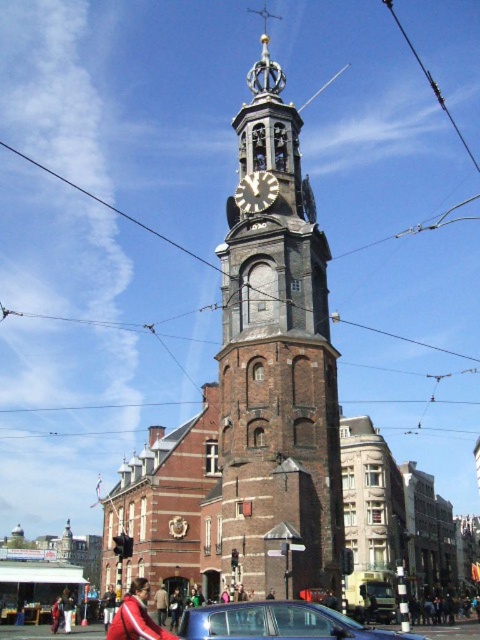
Question: Which point is closer to the camera taking this photo?

Choices:
 (A) (314, 244)
 (B) (307, 632)
 (C) (394, 13)
 (D) (262, 195)

Answer: (B)

Question: Does brick tower at center come behind silver metallic clock at upper center?

Choices:
 (A) yes
 (B) no

Answer: (B)

Question: Among these points, which one is nearest to the camera?

Choices:
 (A) (294, 636)
 (B) (475, 161)
 (C) (299, 224)

Answer: (A)

Question: Which point appears farthest from the camera in this image?

Choices:
 (A) (456, 124)
 (B) (345, 620)

Answer: (A)

Question: Can you confirm if silver metallic clock at upper center is positioned to the right of metallic wire at upper right?

Choices:
 (A) no
 (B) yes

Answer: (A)

Question: Is brick tower at center thinner than silver metallic clock at upper center?

Choices:
 (A) yes
 (B) no

Answer: (B)